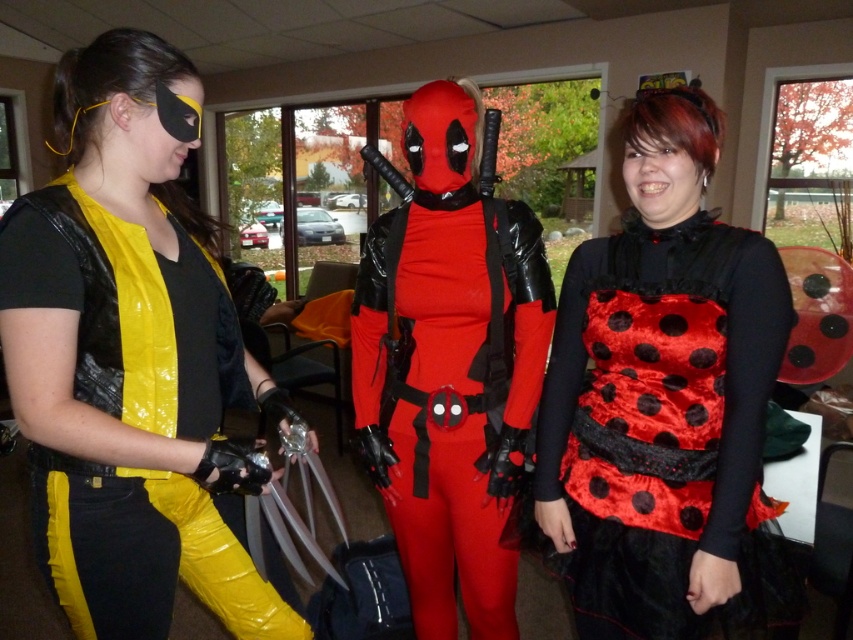
Question: Among these objects, which one is nearest to the camera?

Choices:
 (A) velvet polka dot dress at center
 (B) shiny yellow vest at left
 (C) rubberized red bodysuit at center

Answer: (B)

Question: Estimate the real-world distances between objects in this image. Which object is farther from the velvet polka dot dress at center?

Choices:
 (A) rubberized red bodysuit at center
 (B) shiny yellow vest at left

Answer: (B)

Question: Does shiny yellow vest at left appear on the right side of rubberized red bodysuit at center?

Choices:
 (A) yes
 (B) no

Answer: (B)

Question: Does velvet polka dot dress at center come in front of rubberized red bodysuit at center?

Choices:
 (A) no
 (B) yes

Answer: (B)

Question: Which is farther from the shiny yellow vest at left?

Choices:
 (A) velvet polka dot dress at center
 (B) rubberized red bodysuit at center

Answer: (A)

Question: Does velvet polka dot dress at center come in front of rubberized red bodysuit at center?

Choices:
 (A) yes
 (B) no

Answer: (A)